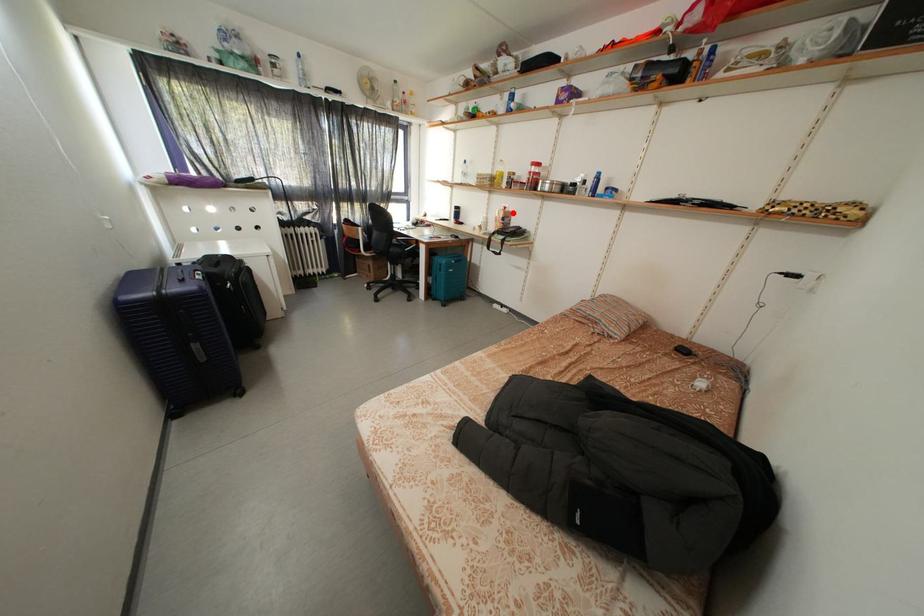
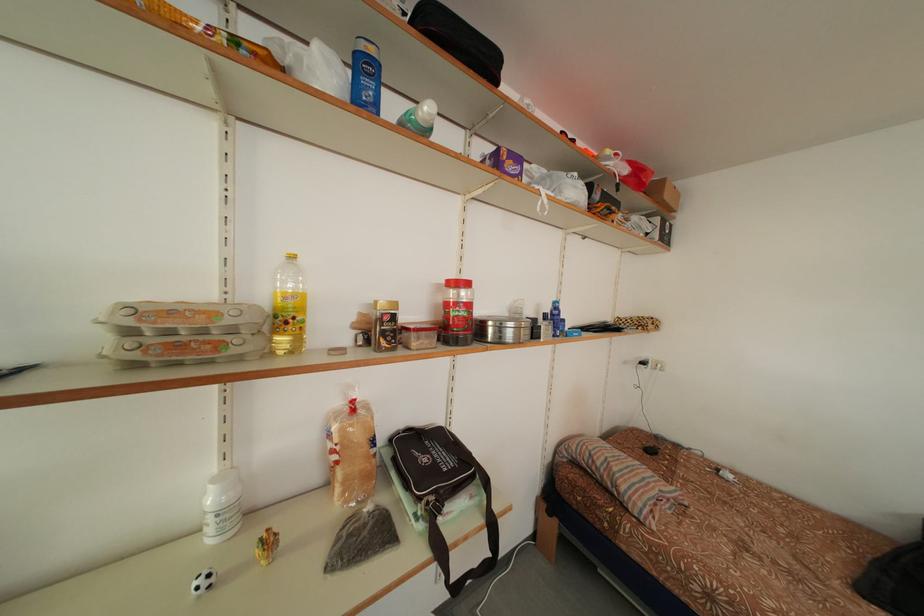
Where in the second image is the point corresponding to the highlighted location from the first image?

(360, 407)